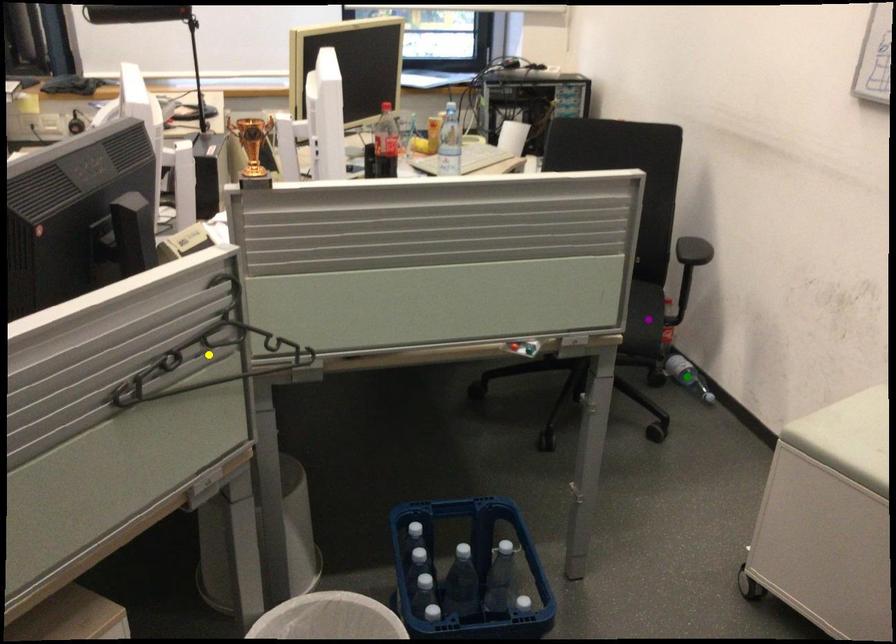
Order these from nearest to farthest:
- purple point
- yellow point
- green point

yellow point → purple point → green point